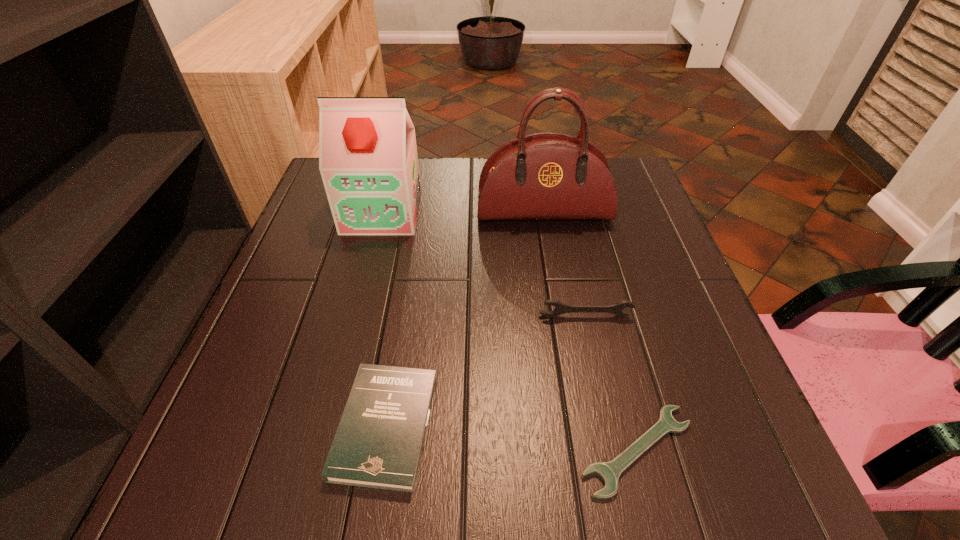
Find the location of a particular element. The width and height of the screenshot is (960, 540). object that is at the near right corner is located at coordinates (609, 472).

Image resolution: width=960 pixels, height=540 pixels. What are the coordinates of `vacant space at the far edge` in the screenshot? It's located at (432, 193).

This screenshot has height=540, width=960. In the image, there is a desktop. What are the coordinates of `free space at the left edge` in the screenshot? It's located at click(304, 237).

I want to click on free space at the right edge of the desktop, so click(660, 227).

At what (x,y) coordinates should I click in order to perform the action: click on free space between the book and the handbag. Please return your answer as a coordinate pair (x, y). The height and width of the screenshot is (540, 960). Looking at the image, I should click on (465, 319).

Locate an element on the screen. free spot between the soya milk and the handbag is located at coordinates (463, 212).

Locate an element on the screen. This screenshot has width=960, height=540. vacant space in between the farther wrench and the shortest object is located at coordinates (612, 383).

Where is `free space between the book and the handbag`? Image resolution: width=960 pixels, height=540 pixels. free space between the book and the handbag is located at coordinates (465, 319).

This screenshot has height=540, width=960. Identify the location of free space between the handbag and the third tallest object. (564, 265).

The width and height of the screenshot is (960, 540). I want to click on free area in between the second shortest object and the handbag, so click(465, 319).